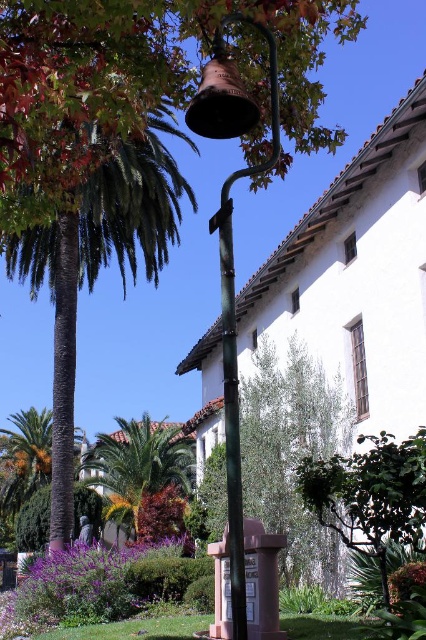
You are standing at point (98, 260) in the scene. What object is located exactly at this point?

The green leafy palm tree at left is located exactly at point (98, 260).

Looking at this image, you are standing in the garden and want to take a photo of the bronze bell at upper center without the green leafy palm tree at center blocking the view. Which direction should you move to ensure the palm tree is no longer in front of the bell?

Move to the right side of the green leafy palm tree at center so that the palm tree is no longer blocking the bronze bell at upper center.

You are standing in the garden and want to touch both the green leafy palm tree at center and the bronze bell at upper center. Which object will you reach first?

You will reach the green leafy palm tree at center first because it is closer to you than the bronze bell at upper center.